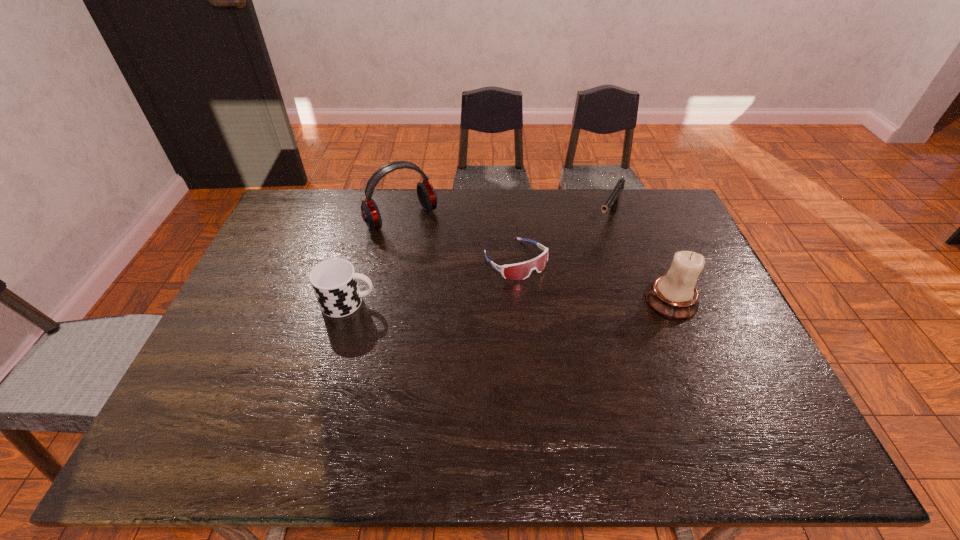
What are the coordinates of `vacant space on the desktop that is between the cup and the candle holder and is positioned on the ear cups of the earphone` in the screenshot? It's located at (467, 302).

Where is `free space on the desktop that is between the cup and the candle holder and is positioned on the front-facing side of the shortest object`? The height and width of the screenshot is (540, 960). free space on the desktop that is between the cup and the candle holder and is positioned on the front-facing side of the shortest object is located at coordinates (554, 301).

The height and width of the screenshot is (540, 960). I want to click on free space on the desktop that is between the cup and the candle holder and is positioned at the muzzle of the pistol, so click(557, 301).